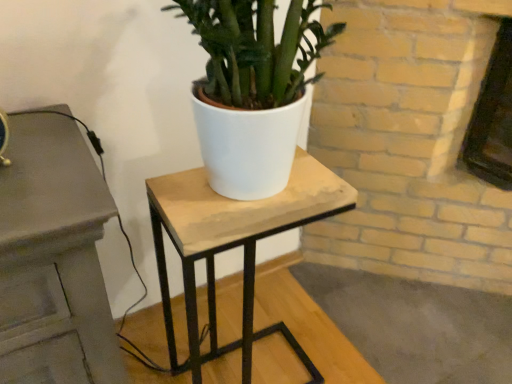
Identify the location of vacant area situated below white matte pot at center (from a real-world perspective). (245, 197).